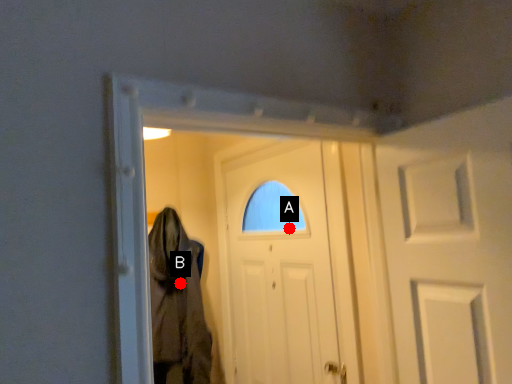
Question: Two points are circled on the image, labeled by A and B beside each circle. Among these points, which one is farthest from the camera?

Choices:
 (A) A is further
 (B) B is further

Answer: (B)